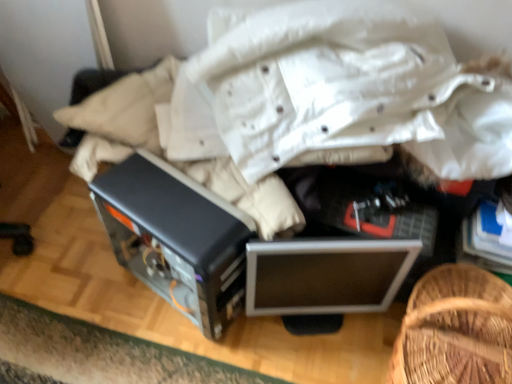
Find the location of a particular element. The height and width of the screenshot is (384, 512). free space on the front side of silver metallic monitor at center is located at coordinates (312, 357).